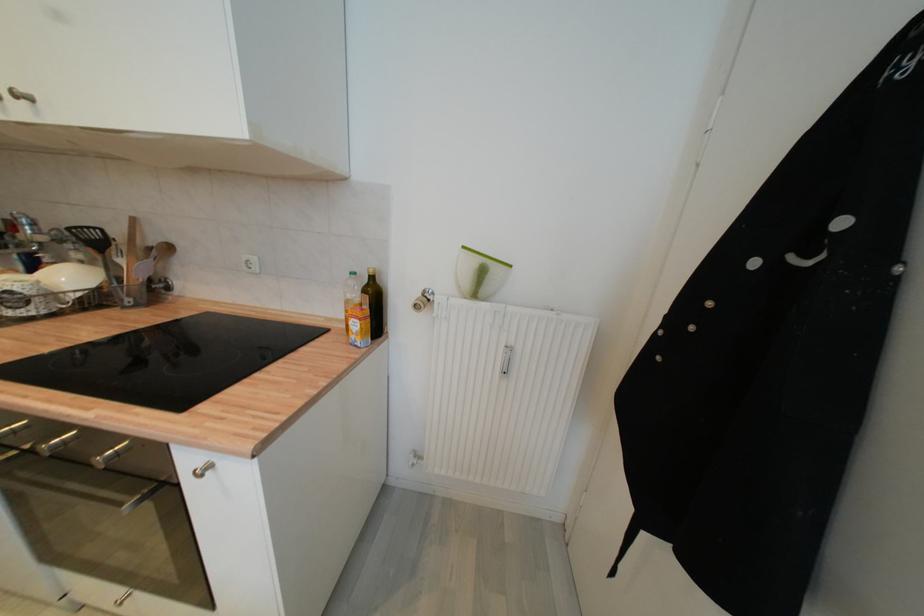
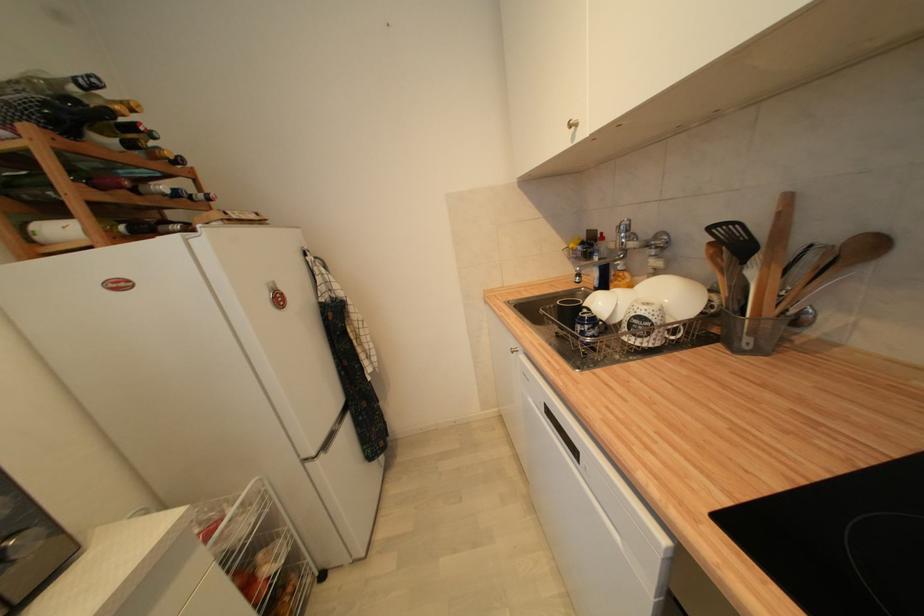
Question: I am providing you with two images of the same scene from different viewpoints. After the viewpoint changes to image2, which objects are now occluded?

Choices:
 (A) metal cabinet handle
 (B) white bowl
 (C) mug handle
 (D) none of these

Answer: (D)